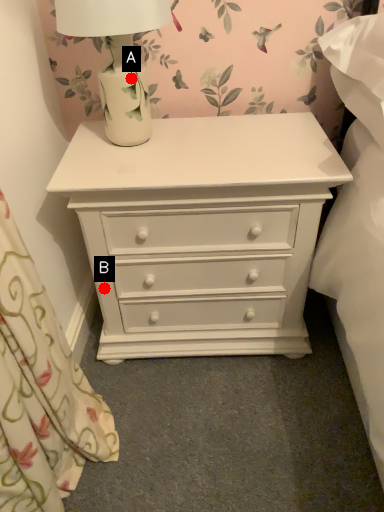
Question: Two points are circled on the image, labeled by A and B beside each circle. Which point appears closest to the camera in this image?

Choices:
 (A) A is closer
 (B) B is closer

Answer: (A)